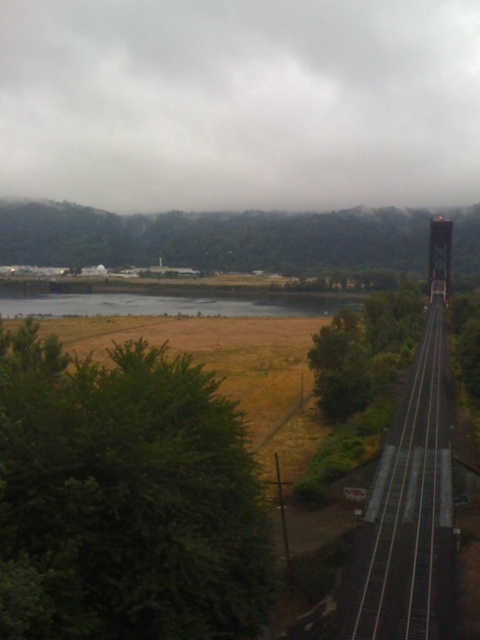
Question: Can you confirm if green leafy tree at center is wider than green grassy field at center?

Choices:
 (A) no
 (B) yes

Answer: (B)

Question: Is gray cloudy sky at upper center positioned behind metal/smooth track at right?

Choices:
 (A) no
 (B) yes

Answer: (B)

Question: Among these objects, which one is farthest from the camera?

Choices:
 (A) green leafy tree at center-right
 (B) metal/smooth track at right

Answer: (A)

Question: Which of the following is the farthest from the observer?

Choices:
 (A) metal/smooth track at right
 (B) green grassy field at center
 (C) brushed metal water tower at right

Answer: (C)

Question: Which object is the closest to the brushed metal water tower at right?

Choices:
 (A) green leafy tree at lower left
 (B) metal/smooth track at right
 (C) green grassy field at center
 (D) green leafy tree at center-right

Answer: (D)

Question: Is green leafy tree at center bigger than metal/smooth track at right?

Choices:
 (A) no
 (B) yes

Answer: (B)